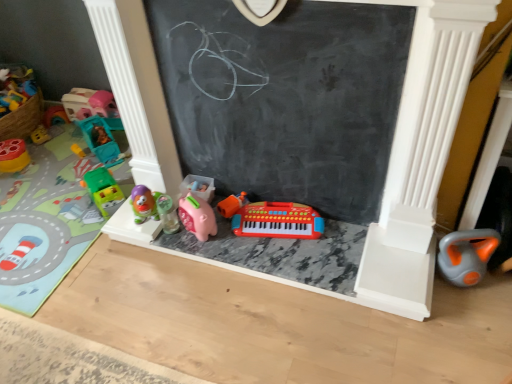
At what (x,y) coordinates should I click in order to perform the action: click on vacant space in between green plastic toy car at left, which is the 4th toy from right to left, and matte yellow and red toy at left, arranged as the 8th toy when viewed from the right. Please return your answer as a coordinate pair (x, y). This screenshot has width=512, height=384. Looking at the image, I should click on (54, 183).